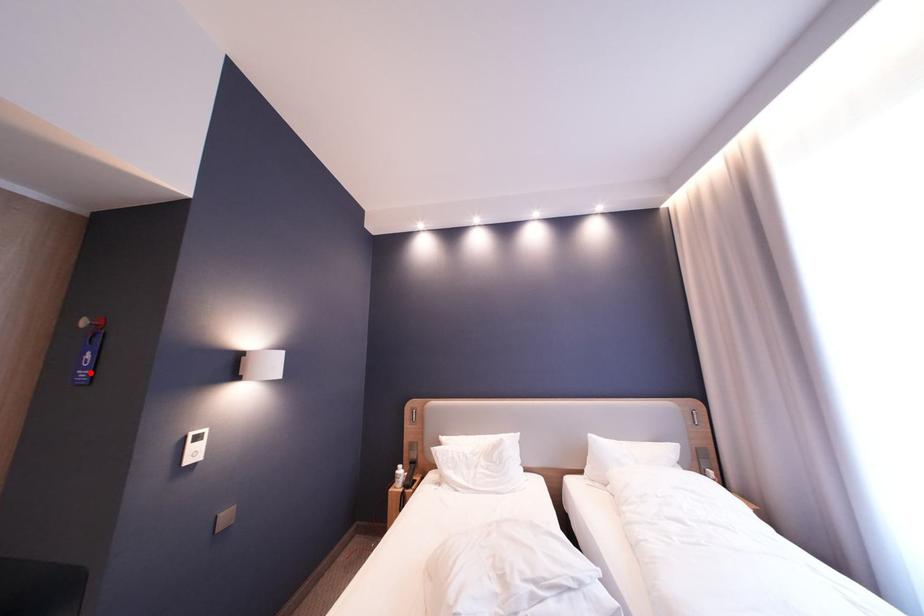
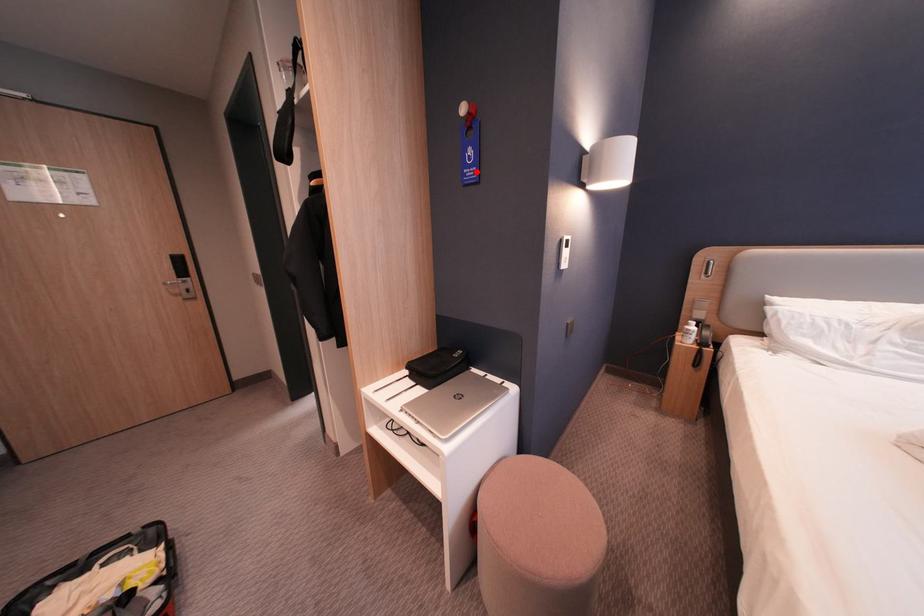
Consider the image. I am providing you with two images of the same scene from different viewpoints. A red point is marked on the first image and another point is marked on the second image. Is the marked point in image1 the same physical position as the marked point in image2?

→ Yes